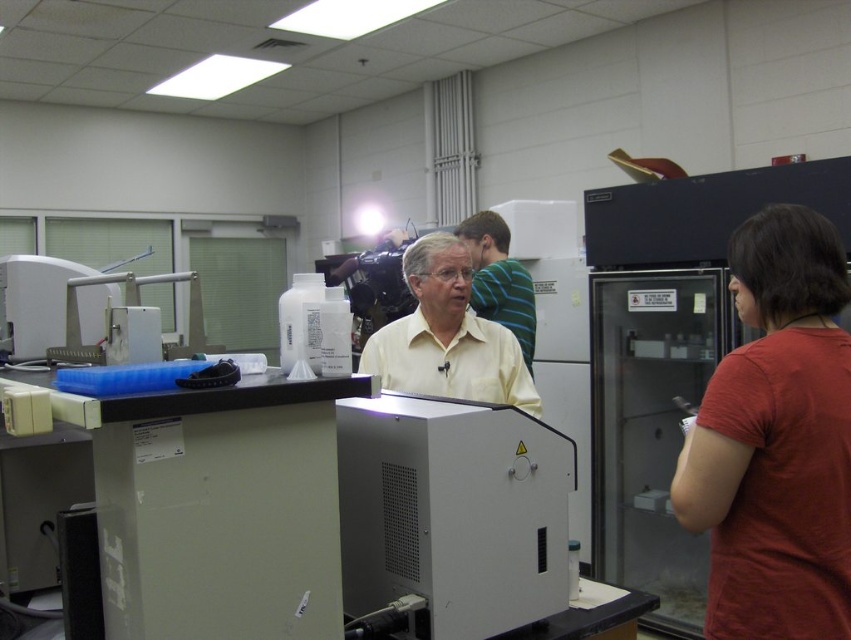
Does red cotton shirt at right have a lesser width compared to white plastic machine at center?

Yes.

Consider the image. Measure the distance between red cotton shirt at right and camera.

red cotton shirt at right and camera are 4.13 feet apart.

Does point (746, 426) lie behind point (463, 436)?

No.

The image size is (851, 640). Identify the location of red cotton shirt at right. tap(775, 440).

This screenshot has width=851, height=640. Describe the element at coordinates (452, 512) in the screenshot. I see `white plastic machine at center` at that location.

Is white plastic machine at center further to the viewer compared to yellow matte shirt at center?

That is False.

Who is more forward, [431,605] or [494,333]?

Positioned in front is point [431,605].

What are the coordinates of `white plastic machine at center` in the screenshot? It's located at (452, 512).

Is point (484, 364) closer to camera compared to point (524, 289)?

Yes.

Does point (363, 362) come farther from viewer compared to point (501, 257)?

That is False.

The image size is (851, 640). What do you see at coordinates (447, 336) in the screenshot?
I see `yellow matte shirt at center` at bounding box center [447, 336].

You are a GUI agent. You are given a task and a screenshot of the screen. Output one action in this format:
    pyautogui.click(x=<x>, y=<y>)
    Task: Click on the yellow matte shirt at center
    This screenshot has height=640, width=851.
    Given the screenshot: What is the action you would take?
    pyautogui.click(x=447, y=336)